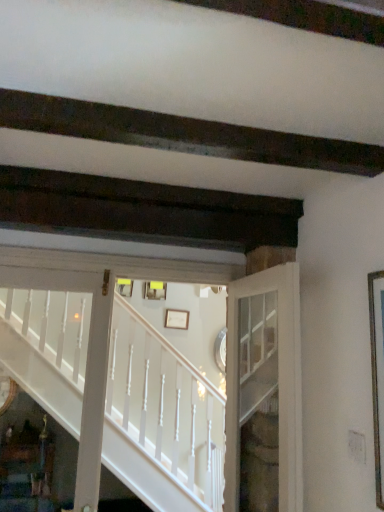
Question: Can you confirm if white painted wood stairs at center is taller than white matte picture frame at center, which is the second picture frame in top-to-bottom order?

Choices:
 (A) no
 (B) yes

Answer: (B)

Question: Is white painted wood stairs at center directly adjacent to white matte picture frame at center, marked as the first picture frame in a right-to-left arrangement?

Choices:
 (A) yes
 (B) no

Answer: (B)

Question: Can you confirm if white painted wood stairs at center is positioned to the right of white matte picture frame at center, which is the second picture frame in top-to-bottom order?

Choices:
 (A) yes
 (B) no

Answer: (B)

Question: Can you confirm if white painted wood stairs at center is shorter than white matte picture frame at center, which is the second picture frame in top-to-bottom order?

Choices:
 (A) no
 (B) yes

Answer: (A)

Question: Does white painted wood stairs at center have a lesser width compared to white matte picture frame at center, which is the second picture frame in top-to-bottom order?

Choices:
 (A) yes
 (B) no

Answer: (B)

Question: Is white painted wood stairs at center to the left of white matte picture frame at center, the 2th picture frame positioned from the left, from the viewer's perspective?

Choices:
 (A) yes
 (B) no

Answer: (A)

Question: Is white glass door at center looking in the opposite direction of white painted wood stairs at center?

Choices:
 (A) no
 (B) yes

Answer: (A)

Question: From the image's perspective, is white glass door at center on top of white painted wood stairs at center?

Choices:
 (A) no
 (B) yes

Answer: (A)

Question: Is white glass door at center in front of white painted wood stairs at center?

Choices:
 (A) yes
 (B) no

Answer: (A)

Question: Considering the relative sizes of white glass door at center and white painted wood stairs at center in the image provided, is white glass door at center taller than white painted wood stairs at center?

Choices:
 (A) yes
 (B) no

Answer: (B)

Question: Is white painted wood stairs at center completely or partially inside white glass door at center?

Choices:
 (A) yes
 (B) no

Answer: (B)

Question: Considering the relative positions of white glass door at center and white painted wood stairs at center in the image provided, is white glass door at center behind white painted wood stairs at center?

Choices:
 (A) yes
 (B) no

Answer: (B)

Question: Would you say white glass door at center is outside matte yellow picture frame at center, which is counted as the first picture frame, starting from the top?

Choices:
 (A) yes
 (B) no

Answer: (A)